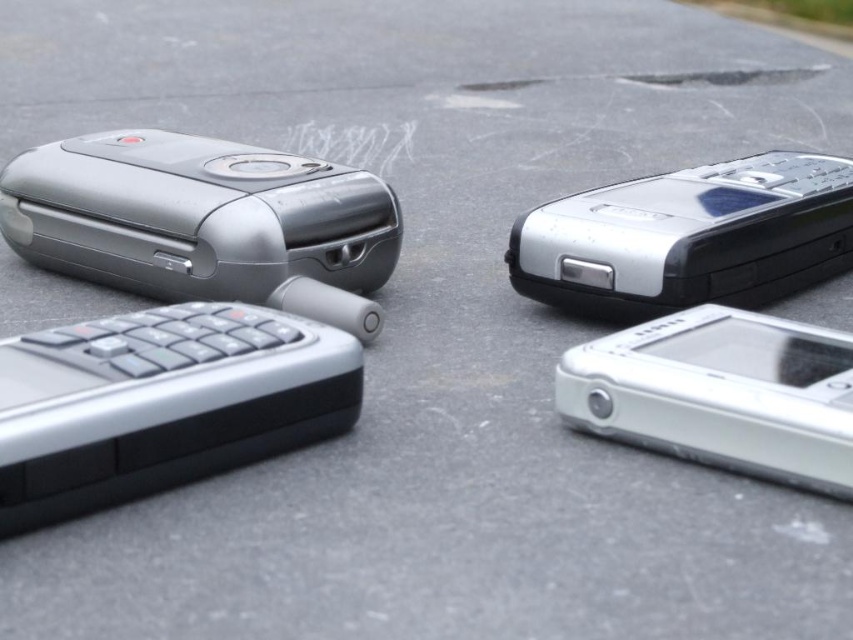
From the picture: You are a collector of vintage phones and you see the satin silver phone at upper right and the sleek silver phone at lower right. Which one is located more to the right side?

The satin silver phone at upper right is positioned on the right side of sleek silver phone at lower right, so it is more to the right side.